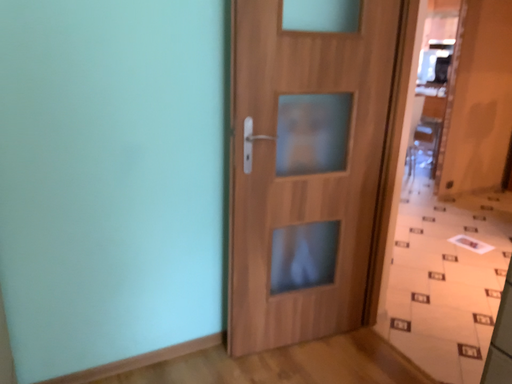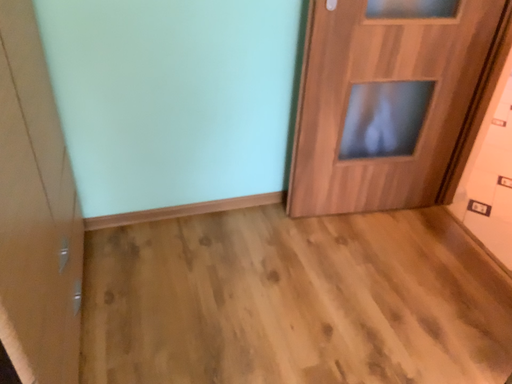
Question: How did the camera likely rotate when shooting the video?

Choices:
 (A) rotated downward
 (B) rotated upward

Answer: (A)